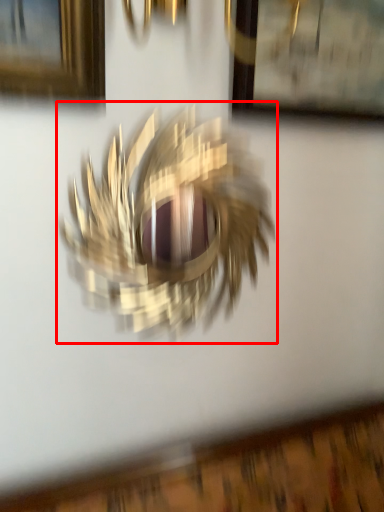
Question: Observing the image, what is the correct spatial positioning of bird (annotated by the red box) in reference to picture frame?

Choices:
 (A) right
 (B) left

Answer: (B)